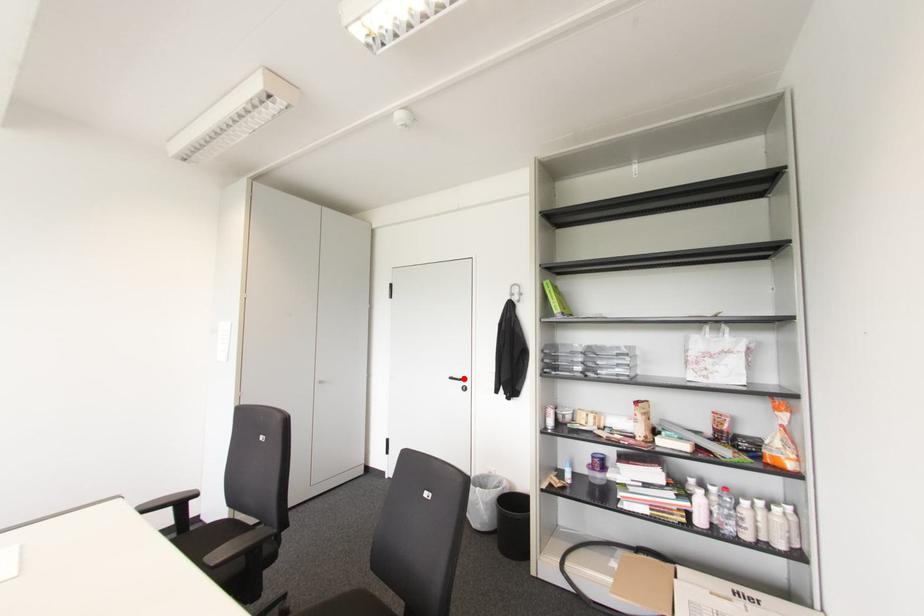
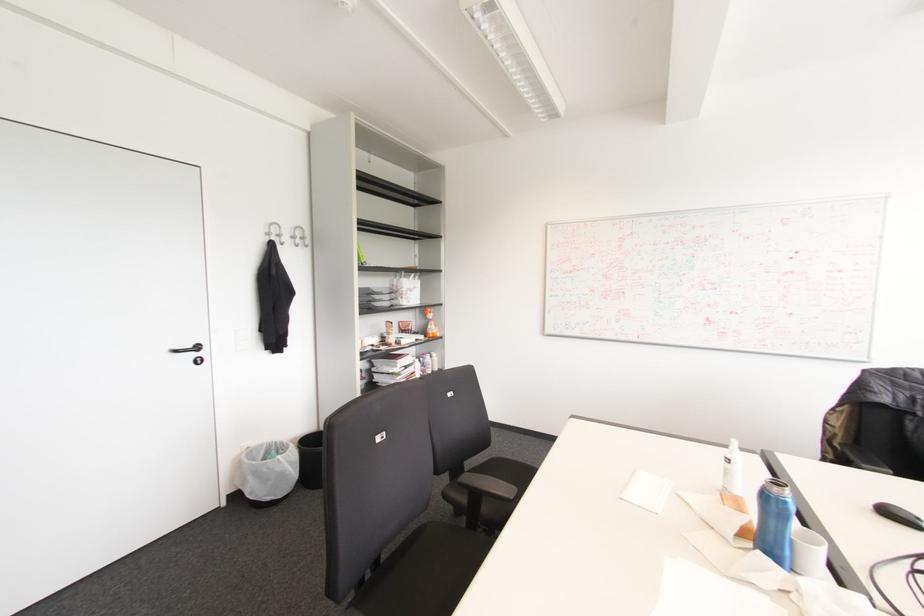
Where in the second image is the point corresponding to the highlighted location from the first image?

(197, 347)